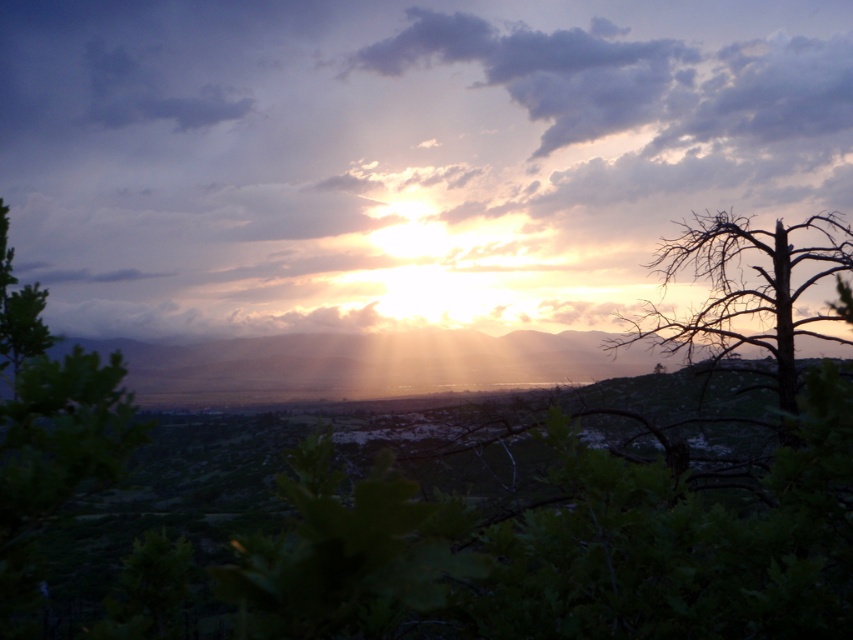
Question: Among these points, which one is farthest from the camera?

Choices:
 (A) (720, 19)
 (B) (772, 326)
 (C) (0, 534)

Answer: (A)

Question: Observing the image, what is the correct spatial positioning of cloudy at upper center in reference to green leafy tree at left?

Choices:
 (A) left
 (B) right

Answer: (B)

Question: Can you confirm if green leafy tree at left is smaller than brown/dry wood tree at right?

Choices:
 (A) yes
 (B) no

Answer: (A)

Question: Which of the following is the farthest from the observer?

Choices:
 (A) (805, 144)
 (B) (16, 289)

Answer: (A)

Question: Which point appears farthest from the camera in this image?

Choices:
 (A) (607, 346)
 (B) (1, 426)
 (C) (538, 177)

Answer: (C)

Question: Can you confirm if cloudy at upper center is positioned to the left of green leafy tree at left?

Choices:
 (A) yes
 (B) no

Answer: (B)